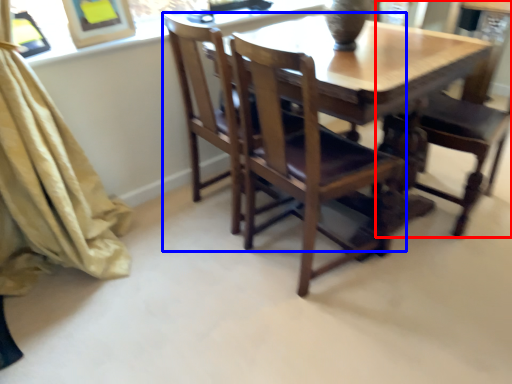
Question: Among these objects, which one is nearest to the camera, chair (highlighted by a red box) or chair (highlighted by a blue box)?

Choices:
 (A) chair
 (B) chair

Answer: (B)